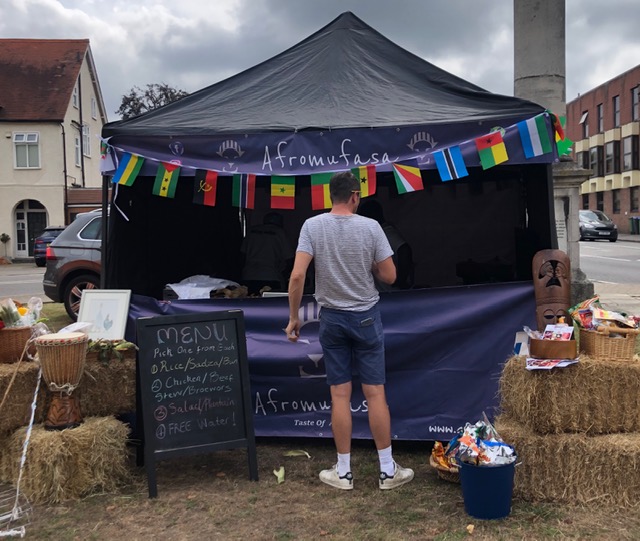
Locate an element on the screen. sock is located at coordinates (342, 466).